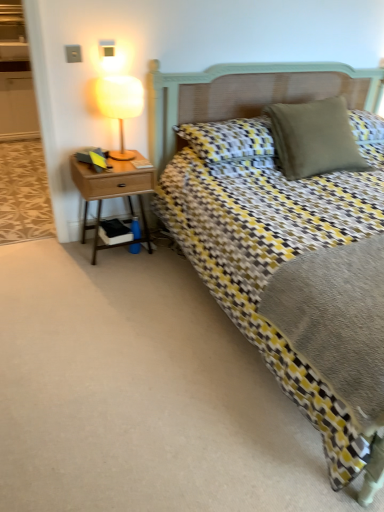
This screenshot has width=384, height=512. What are the coordinates of `free location to the right of woodennightstand at left` in the screenshot? It's located at (168, 258).